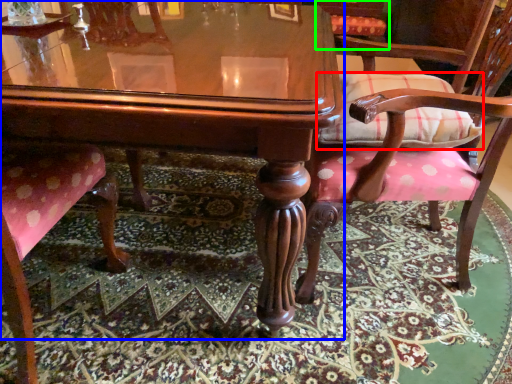
Question: Considering the real-world distances, which object is closest to pillow (highlighted by a red box)? table (highlighted by a blue box) or chair (highlighted by a green box).

Choices:
 (A) table
 (B) chair

Answer: (A)